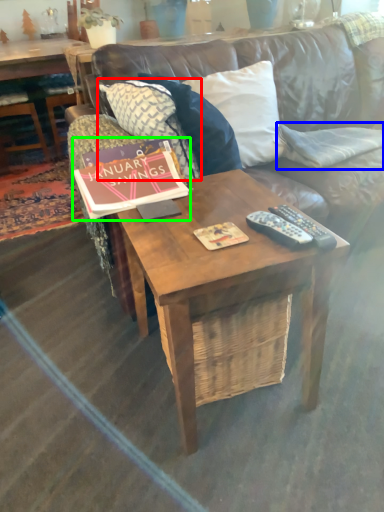
Question: Considering the real-world distances, which object is closest to pillow (highlighted by a red box)? pillow (highlighted by a blue box) or book (highlighted by a green box).

Choices:
 (A) pillow
 (B) book

Answer: (B)